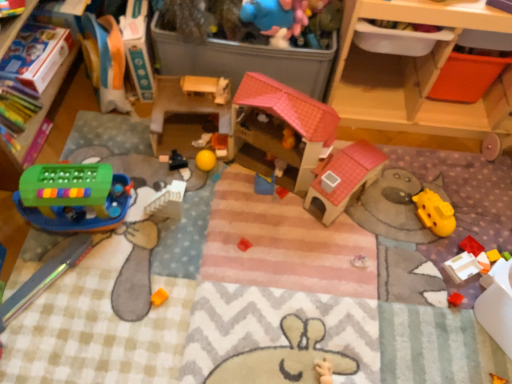
The image size is (512, 384). I want to click on vacant area located to the right-hand side of metallic blue car at center, which appears as the 8th toy when viewed from the right, so click(226, 167).